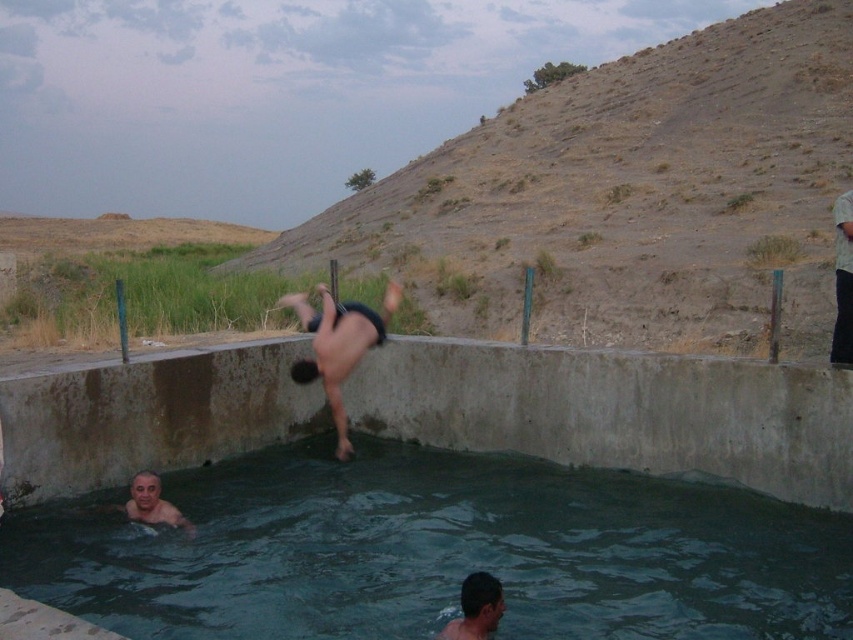
You are standing at the edge of the pool and see the dull brown dirt at upper center and the light brown fabric shirt at right. Which object is positioned to the left of the other?

The dull brown dirt at upper center is to the left of the light brown fabric shirt at right.

You are a photographer trying to capture the entire scene of the natural pool. You notice the dull brown dirt at upper center and the black matte shorts at center. Which object takes up more space in the photo?

The dull brown dirt at upper center takes up more space in the photo because it is bigger than the black matte shorts at center.

You are standing at the edge of the pool and want to reach the dull brown dirt at upper center. Given that the distance is 49.02 feet, can you estimate how many average paces you need to take to reach it?

The distance between you and the dull brown dirt at upper center is 49.02 feet. An average pace is about 2.5 to 3 feet, so dividing 49.02 by 2.5 gives approximately 19.6 paces, and dividing by 3 gives around 16.3 paces. Therefore, you would need roughly 16 to 20 average paces to reach the dull brown dirt at upper center.